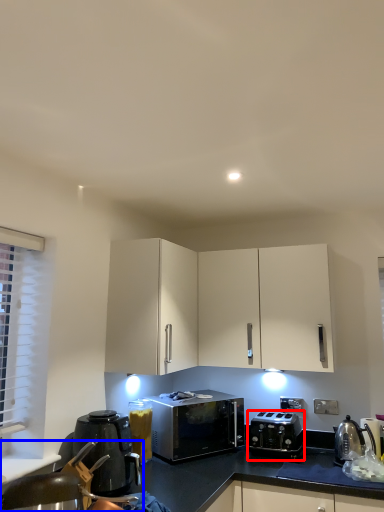
Question: Which of the following is the farthest to the observer, toaster (highlighted by a red box) or swivel chair (highlighted by a blue box)?

Choices:
 (A) toaster
 (B) swivel chair

Answer: (A)